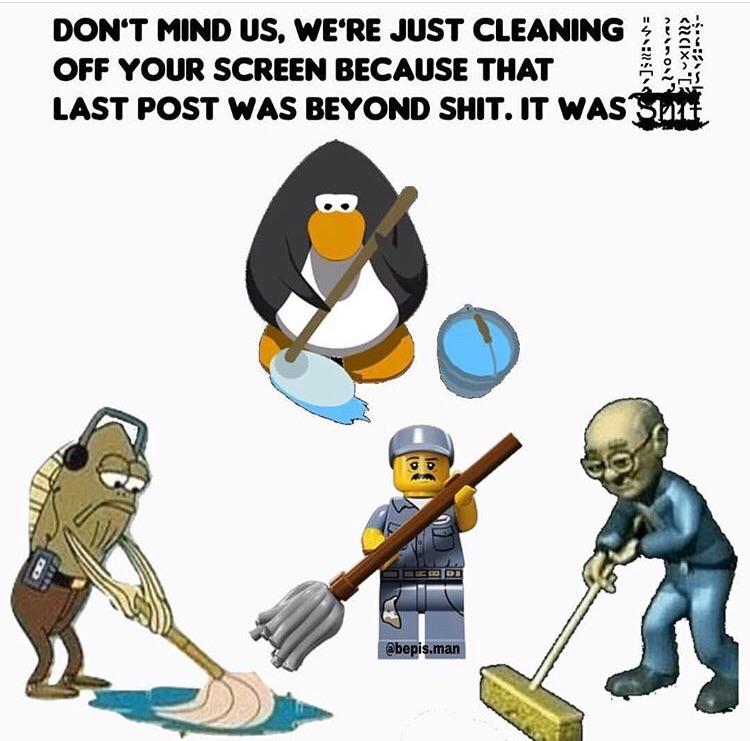
Find the location of `cassette player`. cassette player is located at coordinates (46, 564).